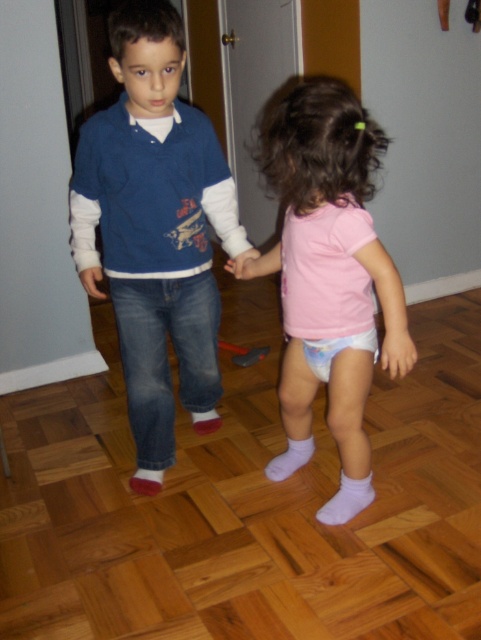
Can you confirm if matte blue sweater at center is positioned below white fabric diaper at center?

No.

Can you confirm if matte blue sweater at center is positioned to the left of white fabric diaper at center?

Yes, matte blue sweater at center is to the left of white fabric diaper at center.

Is point (182, 378) less distant than point (336, 349)?

That is False.

Find the location of a particular element. matte blue sweater at center is located at coordinates (155, 224).

Does matte blue sweater at center appear under white soft sock at lower center?

Incorrect, matte blue sweater at center is not positioned below white soft sock at lower center.

Is matte blue sweater at center positioned at the back of white soft sock at lower center?

No, it is in front of white soft sock at lower center.

Is point (151, 19) positioned after point (352, 509)?

No, it is in front of (352, 509).

Identify the location of matte blue sweater at center. The image size is (481, 640). (155, 224).

Between white soft sock at lower left and matte blue jeans at lower left, which one is positioned lower?

white soft sock at lower left is lower down.

Who is positioned more to the left, white soft sock at lower left or matte blue jeans at lower left?

From the viewer's perspective, matte blue jeans at lower left appears more on the left side.

What do you see at coordinates (147, 481) in the screenshot?
I see `white soft sock at lower left` at bounding box center [147, 481].

Image resolution: width=481 pixels, height=640 pixels. In order to click on white soft sock at lower left in this screenshot , I will do `click(147, 481)`.